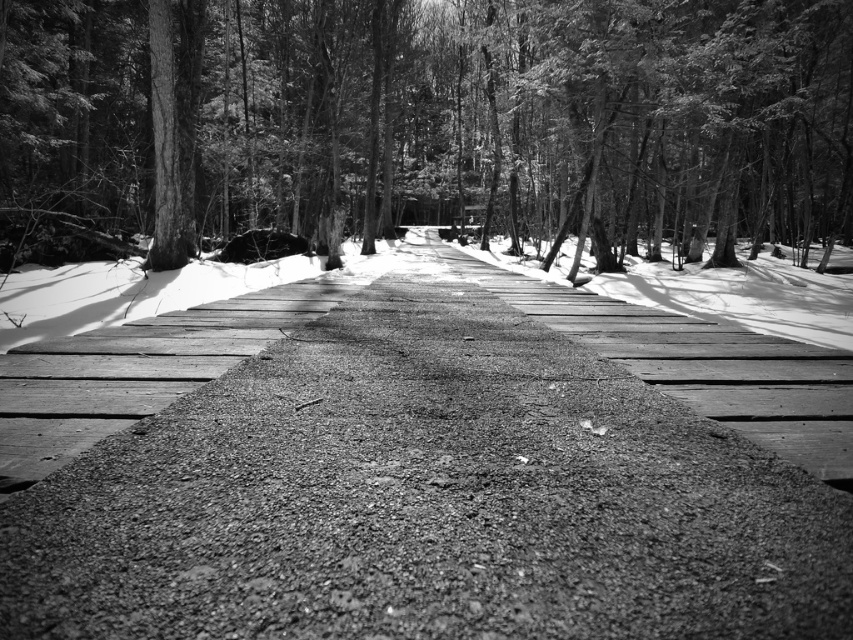
You are a hiker trying to decide between two paths in the forest. You see a dull asphalt road at center and a gravelly asphalt path at center. Which path is closer to you?

The gravelly asphalt path at center is closer to you since the dull asphalt road at center is 13.18 feet away from it.

You are standing at the starting point of the boardwalk and want to reach a point marked as point (527, 344) and another point (807, 156). Which point will you reach first while walking along the boardwalk?

You will reach point (527, 344) first because it is closer to the camera than point (807, 156), meaning it is nearer to your starting position.

You are a hiker trying to decide which path to take. You notice two paths in front of you, the dull asphalt road at center and the gravelly asphalt path at center. Which path is lower in elevation?

The dull asphalt road at center has a lesser height compared to the gravelly asphalt path at center, so the dull asphalt road at center is lower in elevation.